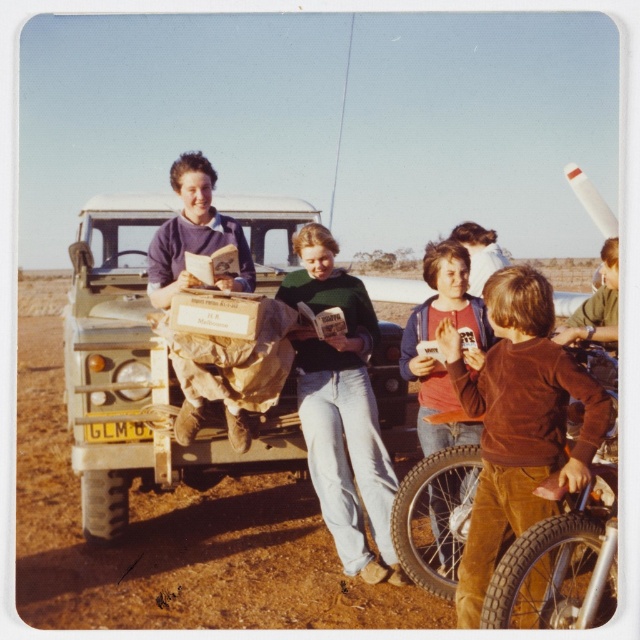
Question: Does light green matte truck at center lie behind brown corduroy pants at lower right?

Choices:
 (A) yes
 (B) no

Answer: (A)

Question: Is light green matte truck at center thinner than brown corduroy pants at lower right?

Choices:
 (A) no
 (B) yes

Answer: (A)

Question: Which of the following is the farthest from the observer?

Choices:
 (A) (148, 196)
 (B) (532, 412)

Answer: (A)

Question: Can you confirm if light green matte truck at center is positioned below brown corduroy pants at lower right?

Choices:
 (A) yes
 (B) no

Answer: (B)